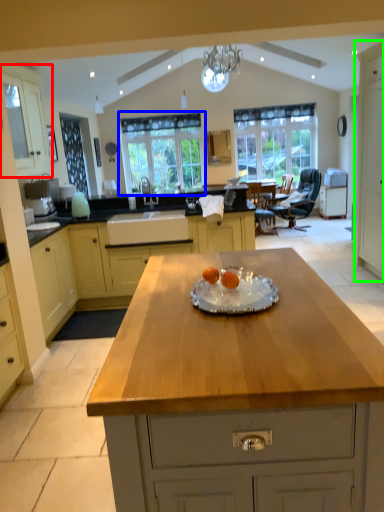
Question: Which object is positioned closest to cabinetry (highlighted by a red box)? Select from window (highlighted by a blue box) and cabinetry (highlighted by a green box).

Choices:
 (A) window
 (B) cabinetry

Answer: (A)